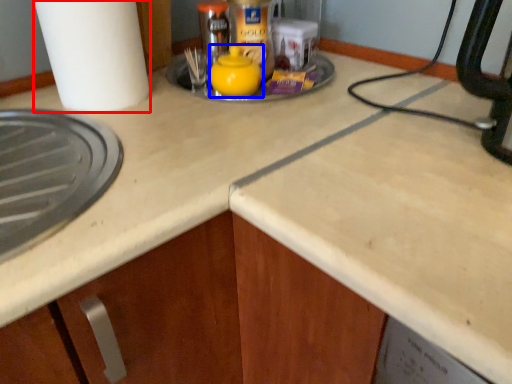
Question: Which of the following is the closest to the observer, paper towel (highlighted by a red box) or tea pot (highlighted by a blue box)?

Choices:
 (A) paper towel
 (B) tea pot

Answer: (A)